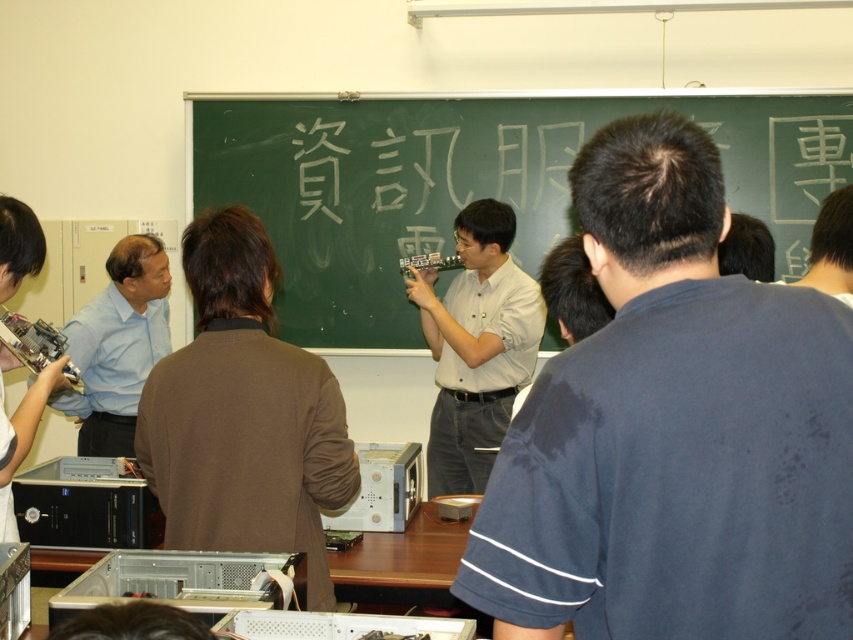
Question: Considering the real-world distances, which object is farthest from the green chalkboard at center?

Choices:
 (A) white chalk writing at center
 (B) brown fabric coat at left

Answer: (B)

Question: Which of the following is the closest to the observer?

Choices:
 (A) (546, 124)
 (B) (213, 332)

Answer: (B)

Question: Does brown fabric coat at left appear under white chalk writing at center?

Choices:
 (A) yes
 (B) no

Answer: (A)

Question: Among these points, which one is farthest from the camera?

Choices:
 (A) (259, 152)
 (B) (439, 424)
 (C) (440, 168)

Answer: (A)

Question: Is light brown shirt at center positioned behind white glossy shirt at center?

Choices:
 (A) yes
 (B) no

Answer: (B)

Question: Does light brown shirt at center lie behind light blue shirt at left?

Choices:
 (A) no
 (B) yes

Answer: (A)